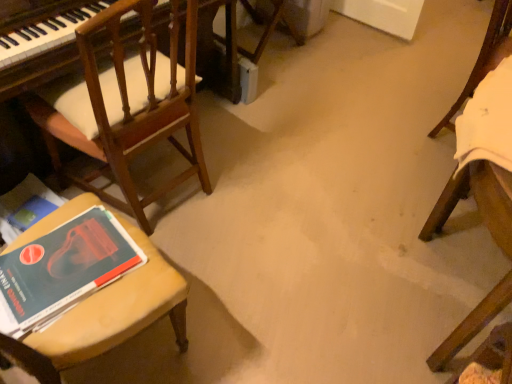
Question: Does wooden chair at left, acting as the first chair starting from the left, have a greater height compared to hardcover book at lower left?

Choices:
 (A) no
 (B) yes

Answer: (B)

Question: From a real-world perspective, is wooden chair at left, acting as the first chair starting from the left, over hardcover book at lower left?

Choices:
 (A) yes
 (B) no

Answer: (B)

Question: Is wooden chair at left, acting as the first chair starting from the left, far away from hardcover book at lower left?

Choices:
 (A) yes
 (B) no

Answer: (B)

Question: Considering the relative sizes of wooden chair at left, acting as the first chair starting from the left, and hardcover book at lower left in the image provided, is wooden chair at left, acting as the first chair starting from the left, shorter than hardcover book at lower left?

Choices:
 (A) yes
 (B) no

Answer: (B)

Question: Can you see wooden chair at left, placed as the 2th chair when sorted from right to left, touching hardcover book at lower left?

Choices:
 (A) no
 (B) yes

Answer: (A)

Question: Considering the positions of white fabric chair at right, arranged as the 1th chair when viewed from the right, and wooden chair at left, placed as the 2th chair when sorted from right to left, in the image, is white fabric chair at right, arranged as the 1th chair when viewed from the right, wider or thinner than wooden chair at left, placed as the 2th chair when sorted from right to left,?

Choices:
 (A) wide
 (B) thin

Answer: (B)

Question: Is white fabric chair at right, the second chair positioned from the left, taller or shorter than wooden chair at left, acting as the first chair starting from the left?

Choices:
 (A) tall
 (B) short

Answer: (B)

Question: Is white fabric chair at right, arranged as the 1th chair when viewed from the right, situated inside wooden chair at left, acting as the first chair starting from the left, or outside?

Choices:
 (A) outside
 (B) inside

Answer: (A)

Question: In terms of size, does white fabric chair at right, arranged as the 1th chair when viewed from the right, appear bigger or smaller than wooden chair at left, acting as the first chair starting from the left?

Choices:
 (A) small
 (B) big

Answer: (A)

Question: Does point (9, 264) appear closer or farther from the camera than point (480, 61)?

Choices:
 (A) farther
 (B) closer

Answer: (B)

Question: In the image, is hardcover book at lower left on the left side or the right side of white fabric chair at right, arranged as the 1th chair when viewed from the right?

Choices:
 (A) left
 (B) right

Answer: (A)

Question: Is hardcover book at lower left inside or outside of white fabric chair at right, the second chair positioned from the left?

Choices:
 (A) inside
 (B) outside

Answer: (B)

Question: From the image's perspective, is hardcover book at lower left positioned above or below white fabric chair at right, arranged as the 1th chair when viewed from the right?

Choices:
 (A) above
 (B) below

Answer: (B)

Question: Do you think hardcover book at lower left is within wooden chair at left, placed as the 2th chair when sorted from right to left, or outside of it?

Choices:
 (A) outside
 (B) inside

Answer: (A)

Question: Relative to wooden chair at left, placed as the 2th chair when sorted from right to left, is hardcover book at lower left in front or behind?

Choices:
 (A) front
 (B) behind

Answer: (A)